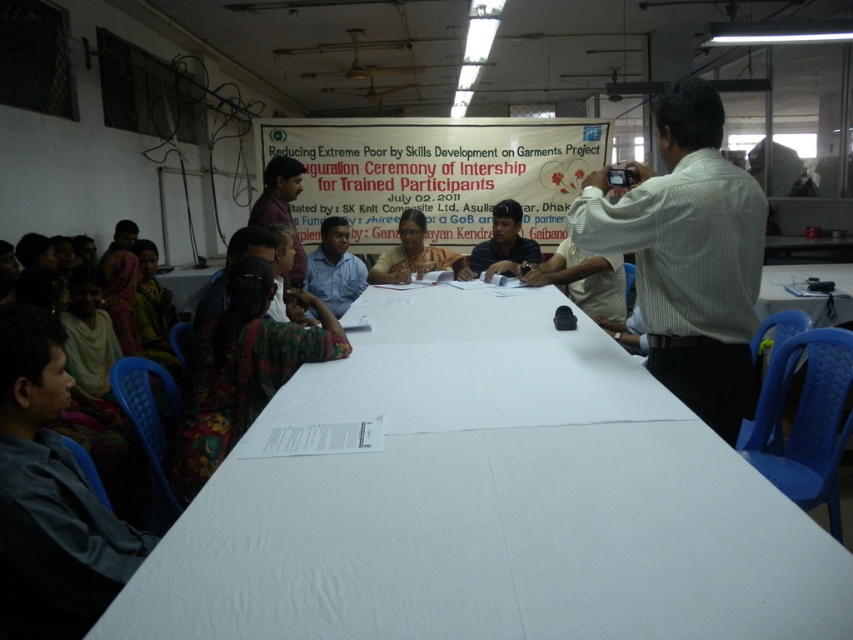
You are attending a skills development ceremony for garment workers and notice the white plastic table at center and the dark blue shirt at center. Which object is taller?

The dark blue shirt at center is taller than the white plastic table at center.

You are standing at point (390,358) and want to walk to the other side of the room. The shortest path requires passing through a point that is 2.27 meters away from your current position. Is this distance sufficient to reach the opposite wall without obstacles?

The distance between the points is 2.27 meters, so if the room is at least 2.27 meters wide in that direction, you can reach the opposite wall. However, the scene description does not provide information about the room dimensions, so we cannot confirm if there are obstacles or if the distance is sufficient.

You are an attendee at this event and want to take a photo of the white paperboard at upper center and the matte blue shirt at center. Can you position yourself so that both are visible in the frame without moving either object?

The white paperboard at upper center is located above the matte blue shirt at center, so if you position yourself at a slight downward angle, you can capture both in the frame without moving either object.